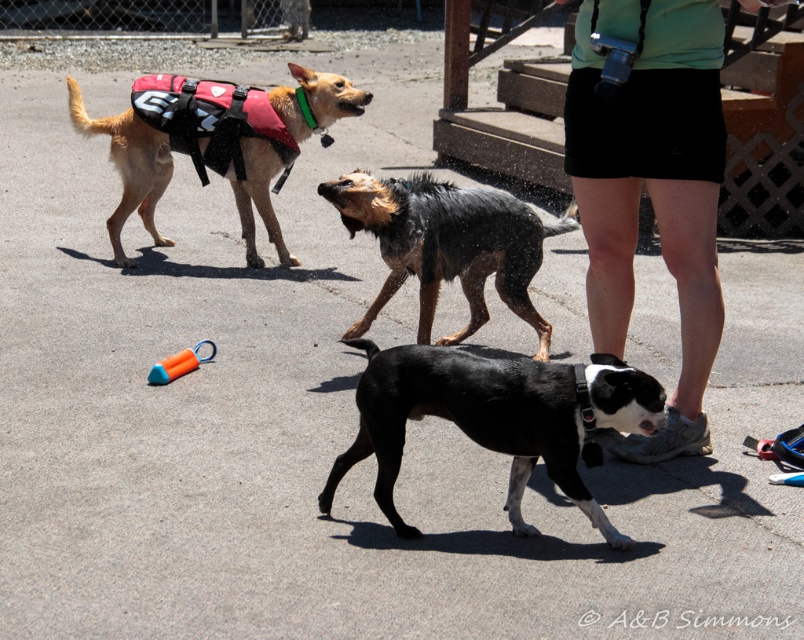
You are standing at the edge of the dock and see the black matte dog at center and the orange rubber toy at center. Which object is taller?

The black matte dog at center is taller than the orange rubber toy at center.

You are standing in the outdoor scene and want to pick up the orange rubber toy at center. Which direction should you move relative to the black matte dog at center?

You should move forward towards the black matte dog at center because it is closer to you than the orange rubber toy at center.

You are a drone operator trying to capture a photo of the black matte dog at center and the red synthetic life jacket at upper left in the same frame. Given that your drone can only capture objects within a 4 meter range, will both objects be in the frame?

The distance between the black matte dog at center and the red synthetic life jacket at upper left is 3.97 meters, which is within the 4 meter range. Therefore, both objects will be captured in the same frame.